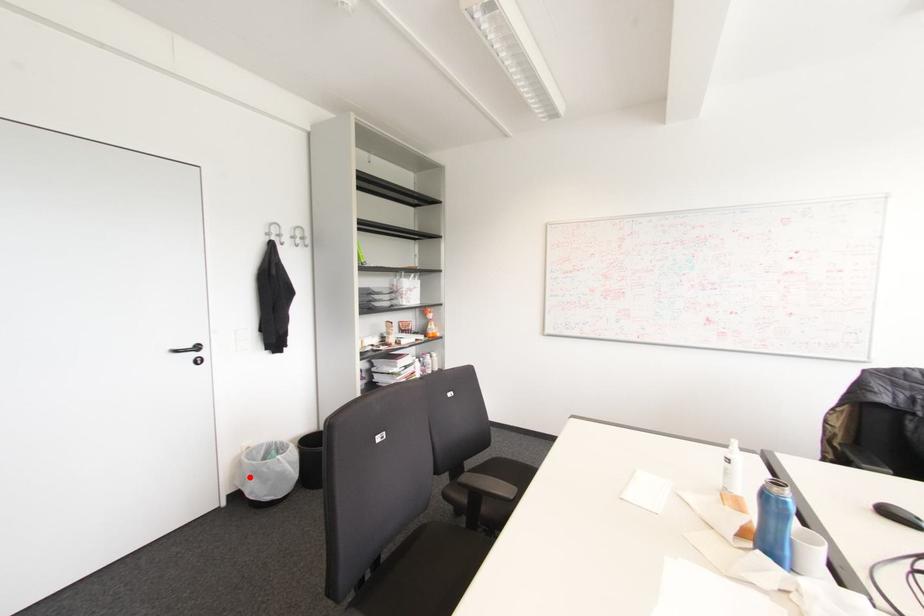
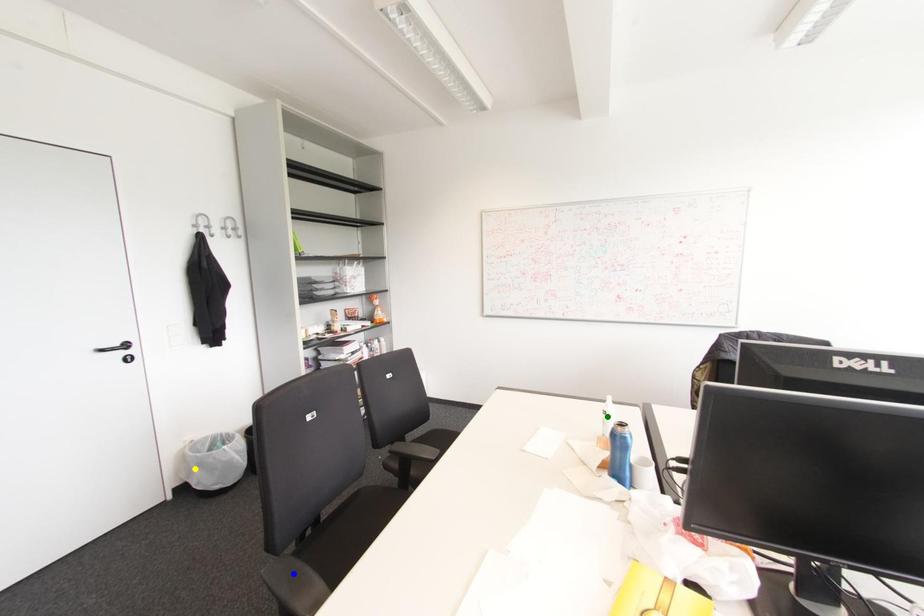
Question: I am providing you with two images of the same scene from different viewpoints. A red point is marked on the first image. You are given multiple points on the second image. In image 2, which mark is for the same physical point as the one in image 1?

Choices:
 (A) blue point
 (B) green point
 (C) yellow point

Answer: (C)